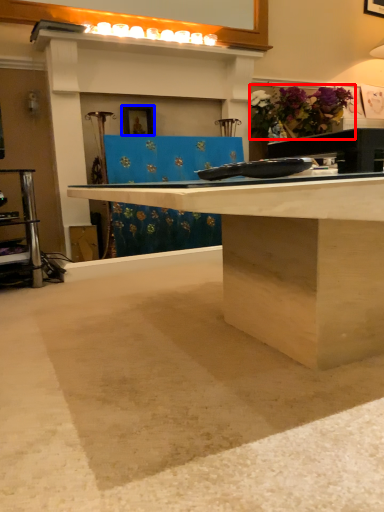
Question: Which point is further to the camera, flower (highlighted by a red box) or picture frame (highlighted by a blue box)?

Choices:
 (A) flower
 (B) picture frame

Answer: (A)